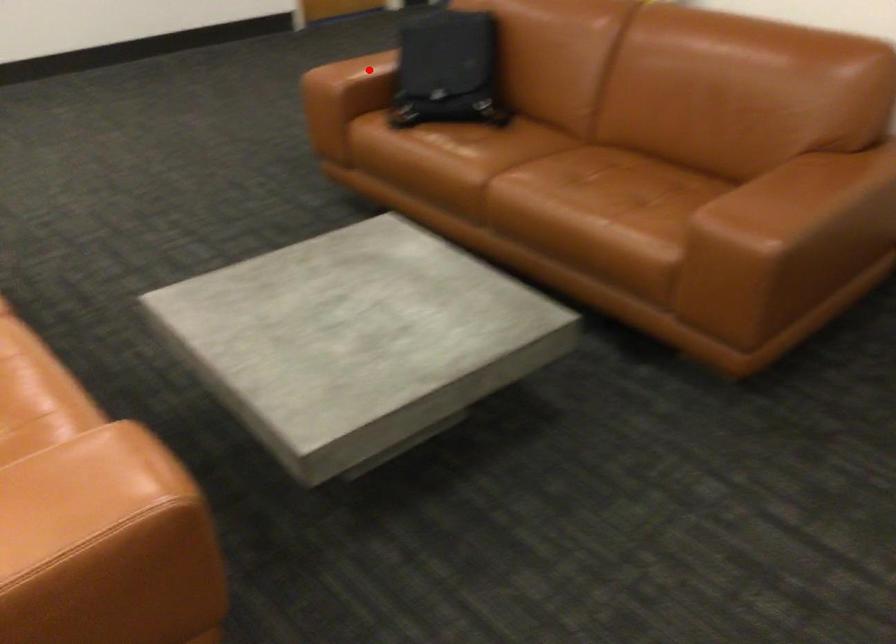
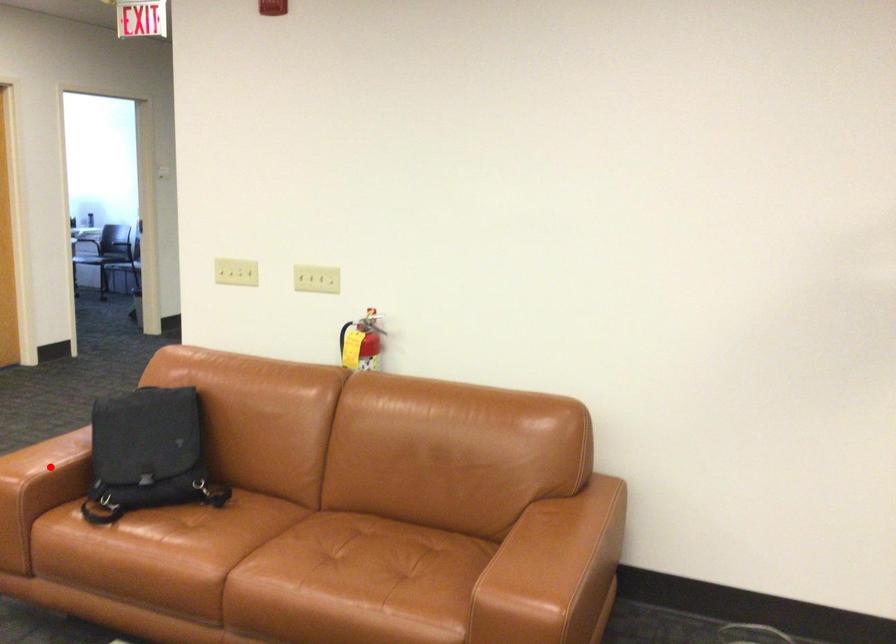
I am providing you with two images of the same scene from different viewpoints. A red point is marked on the first image and another point is marked on the second image. Does the point marked in image1 correspond to the same location as the one in image2?

Yes